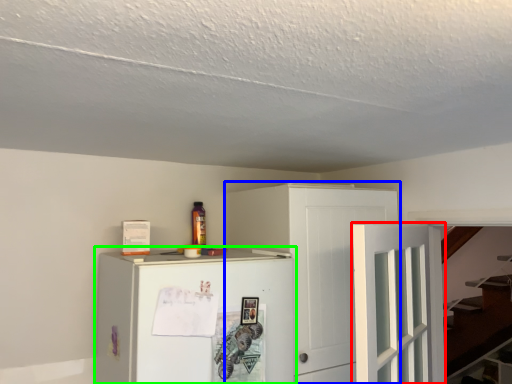
Question: Which object is the farthest from door (highlighted by a red box)? Choose among these: cabinetry (highlighted by a blue box) or refrigerator (highlighted by a green box).

Choices:
 (A) cabinetry
 (B) refrigerator

Answer: (B)